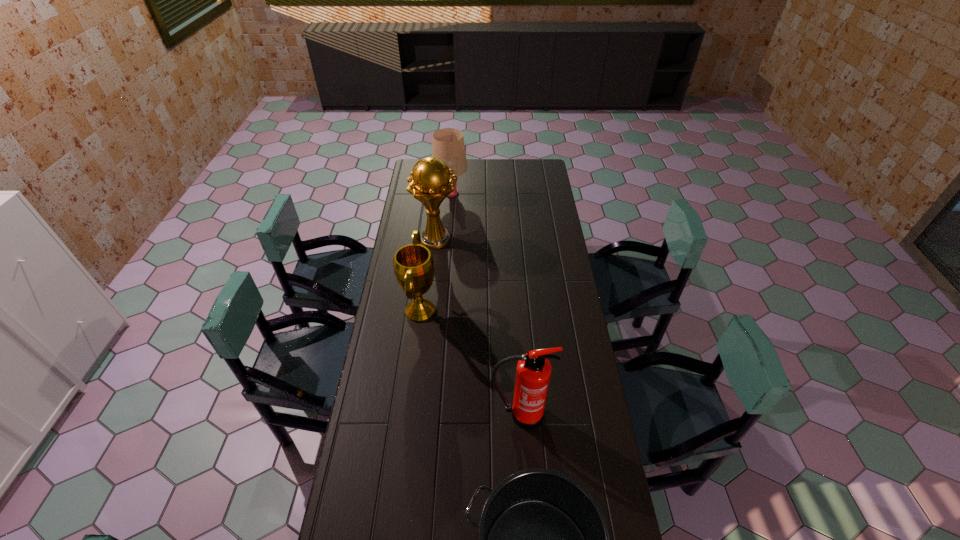
Identify which object is located as the third nearest to the second nearest object. Please provide its 2D coordinates. Your answer should be formatted as a tuple, i.e. [(x, y)], where the tuple contains the x and y coordinates of a point satisfying the conditions above.

[(430, 184)]